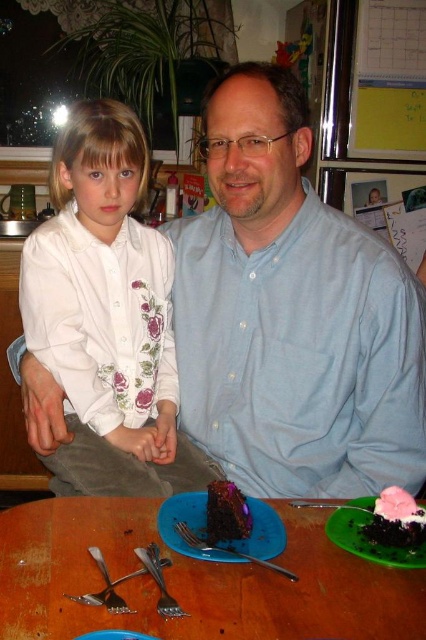
Question: Which point appears farthest from the camera in this image?

Choices:
 (A) (175, 529)
 (B) (143, 564)

Answer: (A)

Question: Which point is closer to the camera taking this photo?

Choices:
 (A) (403, 531)
 (B) (83, 636)
 (C) (333, 342)

Answer: (B)

Question: Which of these objects is positioned closest to the satin silver fork at lower left?

Choices:
 (A) blue plastic plate at lower center
 (B) green plastic plate at lower right
 (C) pink frosted cake at lower right

Answer: (A)

Question: Can you confirm if brown corduroy pants at center is thinner than satin silver fork at lower center?

Choices:
 (A) no
 (B) yes

Answer: (A)

Question: Where is blue cotton shirt at center located in relation to satin silver fork at lower center in the image?

Choices:
 (A) above
 (B) below

Answer: (A)

Question: Can you confirm if wooden table at center is bigger than white floral shirt at left?

Choices:
 (A) no
 (B) yes

Answer: (A)